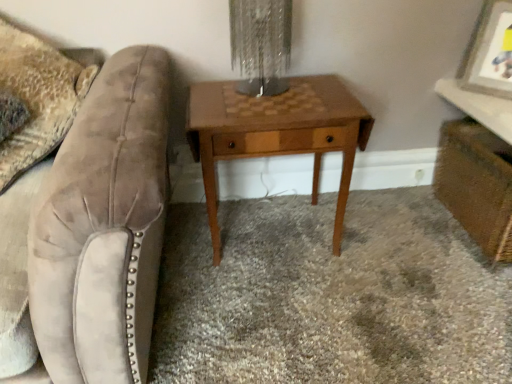
What are the coordinates of `free space below metallic textured lampshade at center (from a real-world perspective)` in the screenshot? It's located at (257, 92).